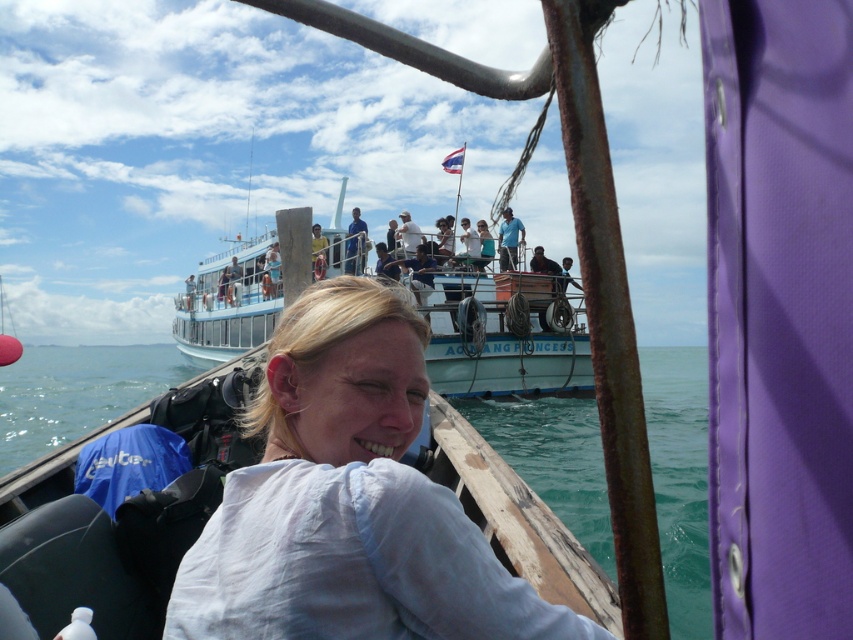
Question: Which point is farther to the camera?

Choices:
 (A) blue shirt at upper center
 (B) white glossy boat at upper center
 (C) white cotton shirt at center
 (D) blue fabric shirt at upper center

Answer: (A)

Question: Is white cotton shirt at center wider than blue shirt at upper center?

Choices:
 (A) no
 (B) yes

Answer: (B)

Question: Which point is closer to the camera taking this photo?

Choices:
 (A) (351, 259)
 (B) (412, 308)
 (C) (479, 276)
 (D) (512, 252)

Answer: (B)

Question: Which object appears farthest from the camera in this image?

Choices:
 (A) white glossy boat at upper center
 (B) blue fabric shirt at upper center
 (C) white cotton shirt at center
 (D) blue shirt at upper center

Answer: (D)

Question: Does white glossy boat at upper center have a lesser width compared to blue fabric shirt at upper center?

Choices:
 (A) no
 (B) yes

Answer: (A)

Question: Is white glossy boat at upper center smaller than blue shirt at upper center?

Choices:
 (A) yes
 (B) no

Answer: (B)